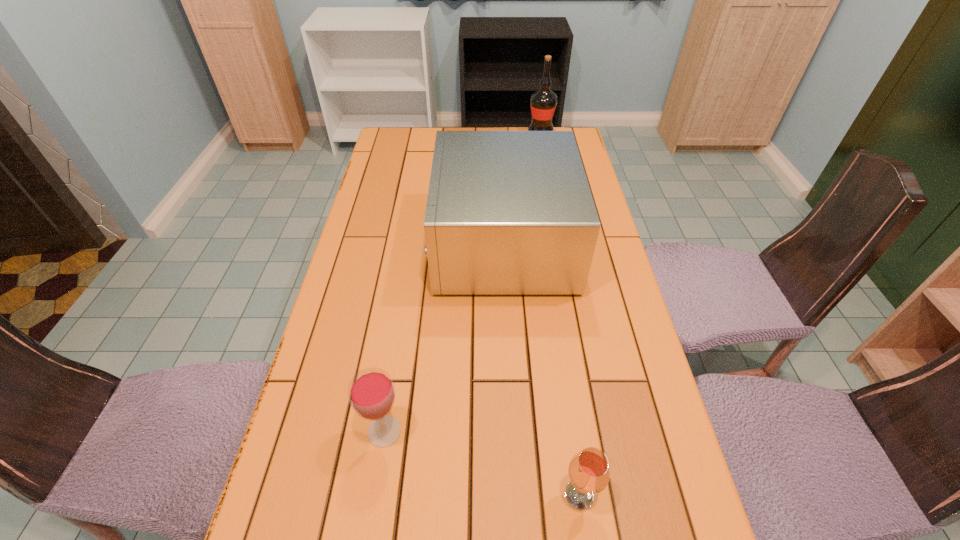
Find the location of a particular element. This screenshot has width=960, height=540. vacant space located 0.250m with the door open on the second tallest object is located at coordinates (349, 243).

Find the location of a particular element. This screenshot has width=960, height=540. free location located 0.120m with the door open on the second tallest object is located at coordinates (394, 243).

This screenshot has width=960, height=540. I want to click on free space located 0.270m on the back of the leftmost object, so click(x=403, y=314).

In order to click on vacant space located on the back of the nearest object in this screenshot , I will do `click(560, 364)`.

The height and width of the screenshot is (540, 960). I want to click on object that is positioned at the far edge, so click(x=543, y=102).

Locate an element on the screen. The width and height of the screenshot is (960, 540). object present at the left edge is located at coordinates (371, 392).

This screenshot has width=960, height=540. I want to click on wine bottle located in the right edge section of the desktop, so click(543, 102).

Identify the location of microwave oven located at the right edge. (508, 212).

Identify the location of object at the far right corner. (543, 102).

The width and height of the screenshot is (960, 540). What are the coordinates of `free space at the far edge of the desktop` in the screenshot? It's located at (433, 149).